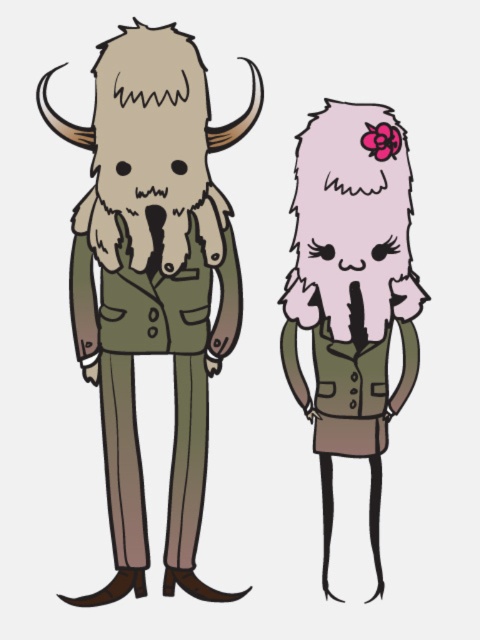
The width and height of the screenshot is (480, 640). Describe the element at coordinates (153, 280) in the screenshot. I see `fuzzy beige fur at left` at that location.

Consider the image. Can you confirm if fuzzy beige fur at left is positioned to the right of pink fluffy fur at right?

Incorrect, fuzzy beige fur at left is not on the right side of pink fluffy fur at right.

Is point (136, 170) closer to camera compared to point (339, 179)?

Yes, point (136, 170) is closer to viewer.

You are a GUI agent. You are given a task and a screenshot of the screen. Output one action in this format:
    pyautogui.click(x=<x>, y=<y>)
    Task: Click on the fuzzy beige fur at left
    This screenshot has width=480, height=640.
    Given the screenshot: What is the action you would take?
    pyautogui.click(x=153, y=280)